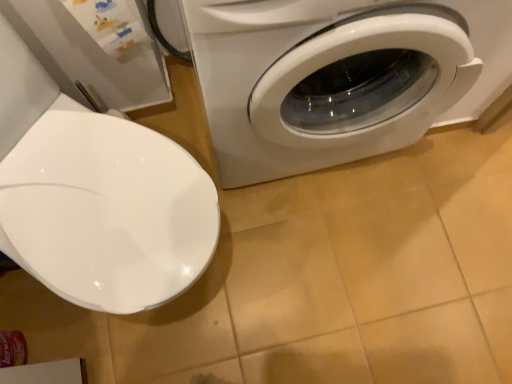
Question: Is white glossy washing machine at right located within white glossy toilet seat at left?

Choices:
 (A) yes
 (B) no

Answer: (B)

Question: Is white glossy toilet seat at left shorter than white glossy washing machine at right?

Choices:
 (A) no
 (B) yes

Answer: (B)

Question: Does white glossy toilet seat at left have a lesser width compared to white glossy washing machine at right?

Choices:
 (A) yes
 (B) no

Answer: (B)

Question: Is white glossy toilet seat at left aimed at white glossy washing machine at right?

Choices:
 (A) no
 (B) yes

Answer: (A)

Question: Are white glossy toilet seat at left and white glossy washing machine at right making contact?

Choices:
 (A) yes
 (B) no

Answer: (B)

Question: Can you confirm if white glossy toilet seat at left is positioned to the right of white glossy washing machine at right?

Choices:
 (A) no
 (B) yes

Answer: (A)

Question: Considering the relative sizes of white glossy washing machine at right and white glossy toilet seat at left in the image provided, is white glossy washing machine at right smaller than white glossy toilet seat at left?

Choices:
 (A) yes
 (B) no

Answer: (B)

Question: Is white glossy washing machine at right beside white glossy toilet seat at left?

Choices:
 (A) yes
 (B) no

Answer: (B)

Question: Does white glossy washing machine at right have a larger size compared to white glossy toilet seat at left?

Choices:
 (A) yes
 (B) no

Answer: (A)

Question: From a real-world perspective, is white glossy washing machine at right located beneath white glossy toilet seat at left?

Choices:
 (A) no
 (B) yes

Answer: (A)

Question: From the image's perspective, is white glossy washing machine at right on white glossy toilet seat at left?

Choices:
 (A) yes
 (B) no

Answer: (A)

Question: Considering the relative sizes of white glossy washing machine at right and white glossy toilet seat at left in the image provided, is white glossy washing machine at right thinner than white glossy toilet seat at left?

Choices:
 (A) no
 (B) yes

Answer: (B)

Question: From the image's perspective, is white glossy washing machine at right above or below white glossy toilet seat at left?

Choices:
 (A) above
 (B) below

Answer: (A)